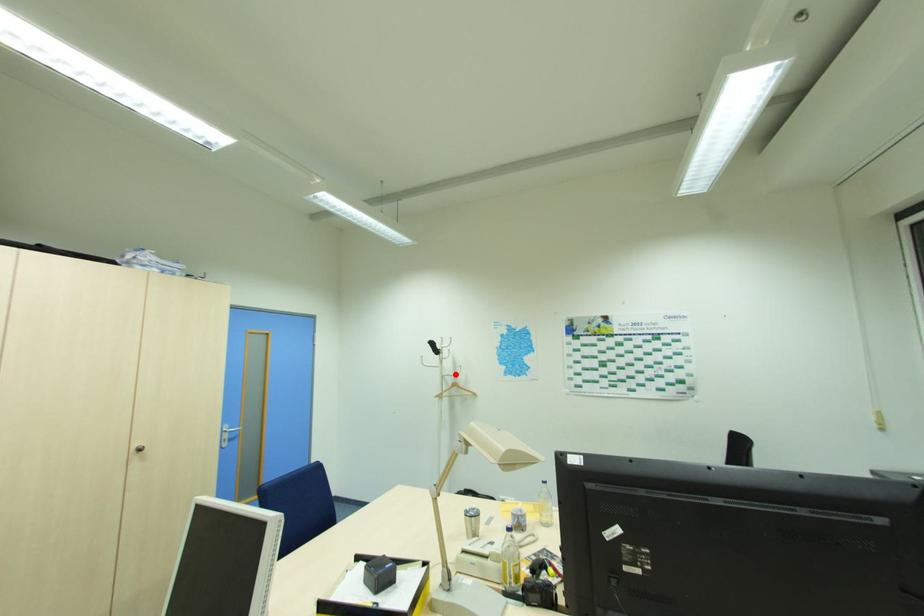
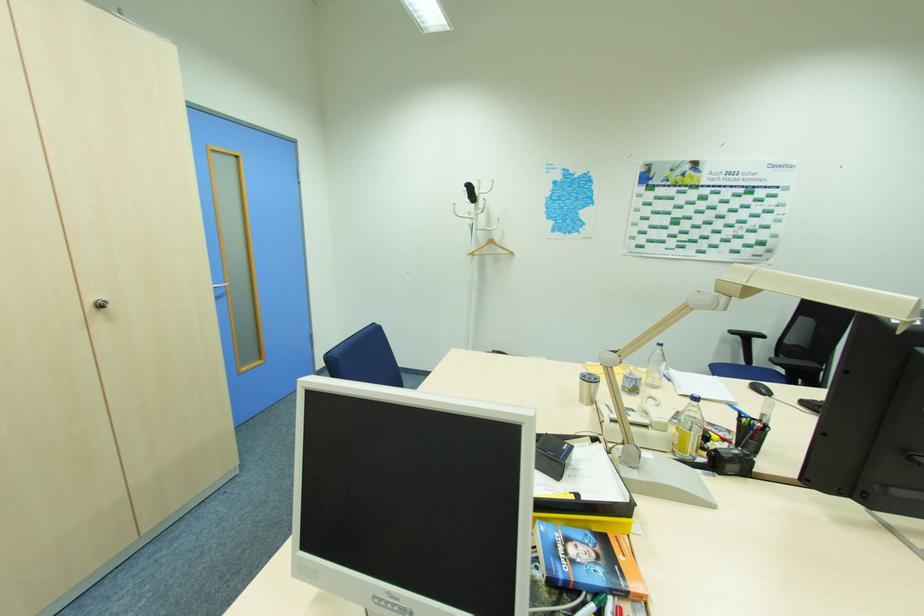
Question: I am providing you with two images of the same scene from different viewpoints. Given a red point in image1, look at the same physical point in image2. Is it:

Choices:
 (A) Closer to the viewpoint
 (B) Farther from the viewpoint

Answer: (A)